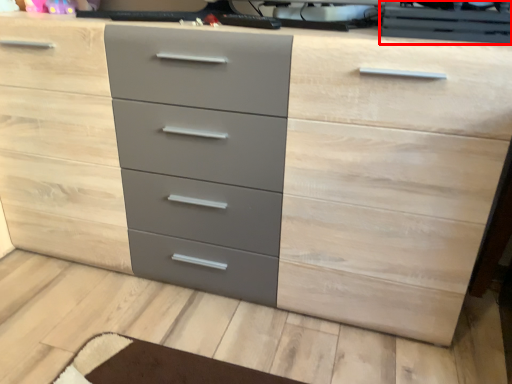
Question: Where is desktop computer (annotated by the red box) located in relation to desktop computer in the image?

Choices:
 (A) left
 (B) right

Answer: (B)